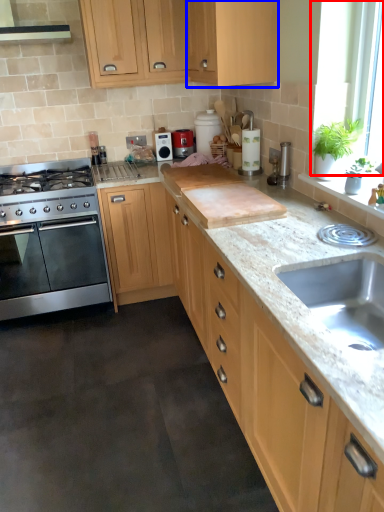
Question: Which of the following is the farthest to the observer, window screen (highlighted by a red box) or cabinetry (highlighted by a blue box)?

Choices:
 (A) window screen
 (B) cabinetry

Answer: (B)